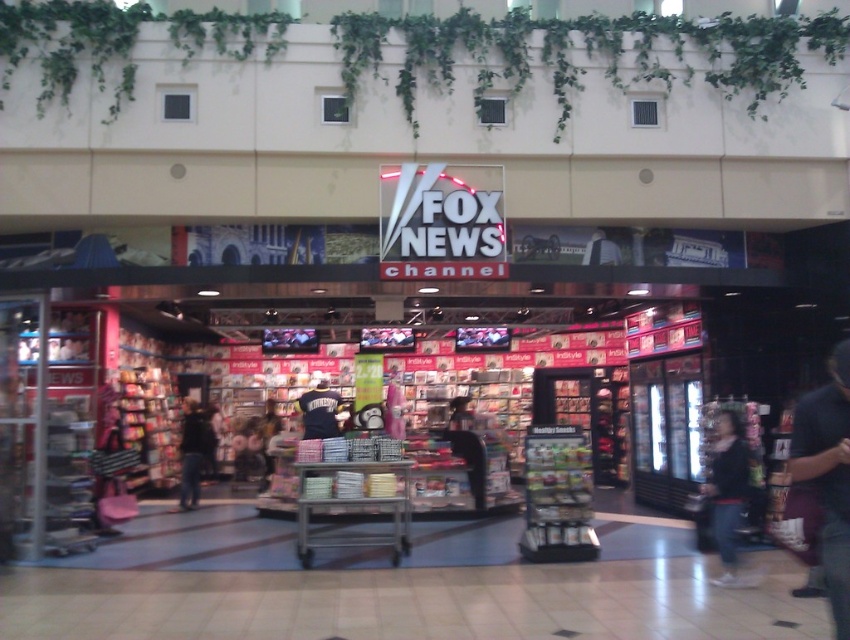
Question: Is dark clothing at center above black jersey at center?

Choices:
 (A) yes
 (B) no

Answer: (B)

Question: Considering the relative positions of dark blue jeans at lower right and dark blue shirt at center in the image provided, where is dark blue jeans at lower right located with respect to dark blue shirt at center?

Choices:
 (A) right
 (B) left

Answer: (A)

Question: Does dark blue shirt at lower right appear under dark blue shirt at center?

Choices:
 (A) yes
 (B) no

Answer: (B)

Question: Based on their relative distances, which object is nearer to the dark blue shirt at lower right?

Choices:
 (A) black jersey at center
 (B) dark clothing at center

Answer: (A)

Question: Based on their relative distances, which object is farther from the dark clothing at center?

Choices:
 (A) dark blue jeans at lower right
 (B) dark blue shirt at lower right
 (C) dark blue shirt at center
 (D) black jersey at center

Answer: (B)

Question: Estimate the real-world distances between objects in this image. Which object is farther from the dark blue jeans at lower right?

Choices:
 (A) black jersey at center
 (B) dark blue shirt at lower right
 (C) dark clothing at center
 (D) dark blue shirt at center

Answer: (C)